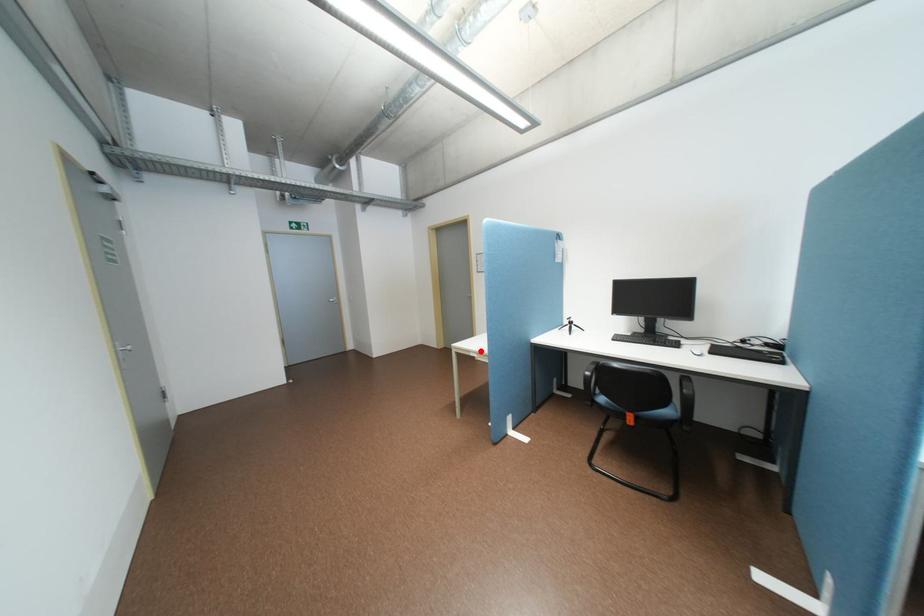
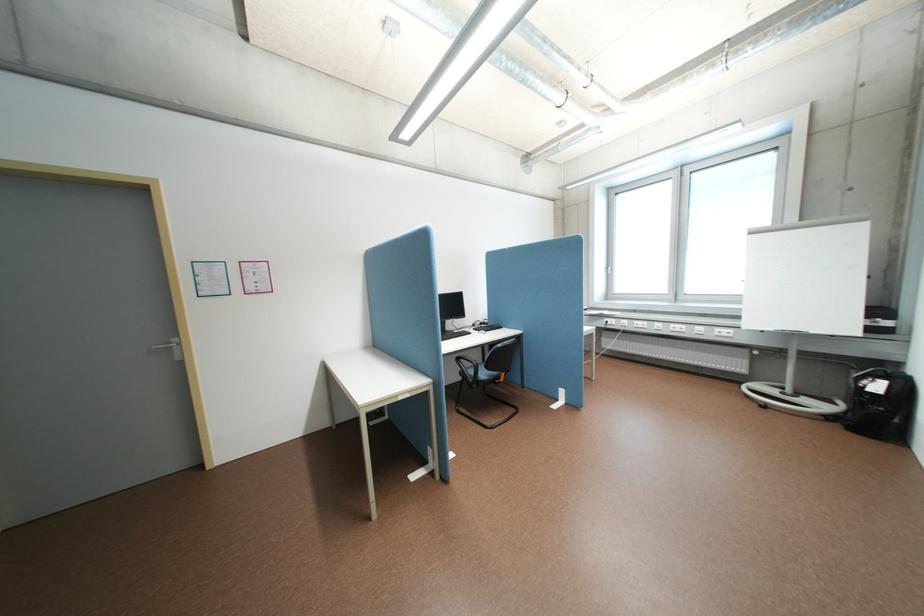
Where in the second image is the point corresponding to the highlighted location from the first image?

(407, 395)